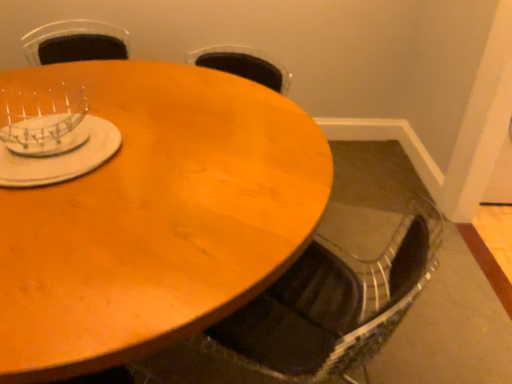
Question: Is wooden table at center wider than metallic silver swivel chair at lower center?

Choices:
 (A) no
 (B) yes

Answer: (B)

Question: Does wooden table at center have a greater height compared to metallic silver swivel chair at lower center?

Choices:
 (A) yes
 (B) no

Answer: (B)

Question: Is wooden table at center aimed at metallic silver swivel chair at lower center?

Choices:
 (A) no
 (B) yes

Answer: (A)

Question: Considering the relative positions of wooden table at center and metallic silver swivel chair at lower center in the image provided, is wooden table at center to the right of metallic silver swivel chair at lower center from the viewer's perspective?

Choices:
 (A) no
 (B) yes

Answer: (A)

Question: Can metallic silver swivel chair at lower center be found inside wooden table at center?

Choices:
 (A) yes
 (B) no

Answer: (A)

Question: Is clear plastic dish rack at upper left, placed as the 2th tableware when sorted from bottom to top, bigger or smaller than wooden table at center?

Choices:
 (A) small
 (B) big

Answer: (A)

Question: In the image, is clear plastic dish rack at upper left, which is the first tableware in top-to-bottom order, positioned in front of or behind wooden table at center?

Choices:
 (A) front
 (B) behind

Answer: (B)

Question: Considering the positions of clear plastic dish rack at upper left, placed as the 2th tableware when sorted from bottom to top, and wooden table at center in the image, is clear plastic dish rack at upper left, placed as the 2th tableware when sorted from bottom to top, wider or thinner than wooden table at center?

Choices:
 (A) thin
 (B) wide

Answer: (A)

Question: Choose the correct answer: Is clear plastic dish rack at upper left, placed as the 2th tableware when sorted from bottom to top, inside wooden table at center or outside it?

Choices:
 (A) inside
 (B) outside

Answer: (B)

Question: Considering the positions of metallic silver swivel chair at lower center and white matte plate at upper left, which is the 2th tableware from top to bottom, in the image, is metallic silver swivel chair at lower center bigger or smaller than white matte plate at upper left, which is the 2th tableware from top to bottom,?

Choices:
 (A) small
 (B) big

Answer: (B)

Question: Is metallic silver swivel chair at lower center taller or shorter than white matte plate at upper left, which is counted as the first tableware, starting from the bottom?

Choices:
 (A) tall
 (B) short

Answer: (A)

Question: Based on their positions, is metallic silver swivel chair at lower center located to the left or right of white matte plate at upper left, which is counted as the first tableware, starting from the bottom?

Choices:
 (A) left
 (B) right

Answer: (B)

Question: Is metallic silver swivel chair at lower center spatially inside white matte plate at upper left, which is counted as the first tableware, starting from the bottom, or outside of it?

Choices:
 (A) outside
 (B) inside

Answer: (A)

Question: Considering the relative positions of wooden table at center and metallic silver swivel chair at lower center in the image provided, is wooden table at center to the left or to the right of metallic silver swivel chair at lower center?

Choices:
 (A) left
 (B) right

Answer: (A)

Question: Looking at their shapes, would you say wooden table at center is wider or thinner than metallic silver swivel chair at lower center?

Choices:
 (A) wide
 (B) thin

Answer: (A)